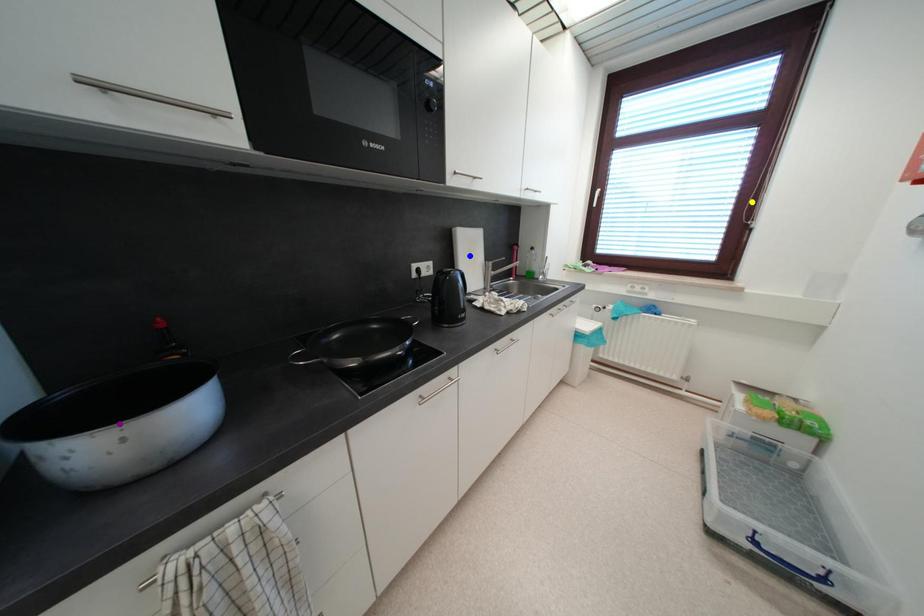
Looking at this image, order these from farthest to nearest:
yellow point, blue point, purple point

yellow point, blue point, purple point